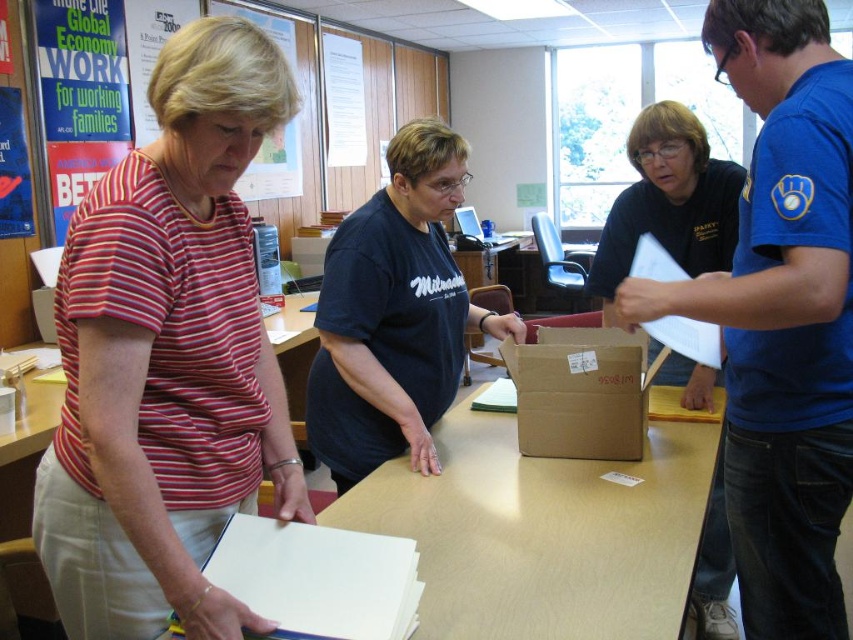
Which of these two, striped cotton shirt at left or brown cardboard box at center, stands taller?

striped cotton shirt at left

Does point (209, 428) lie behind point (517, 358)?

That is False.

Does point (33, 500) lie in front of point (535, 380)?

Yes, point (33, 500) is closer to viewer.

You are a GUI agent. You are given a task and a screenshot of the screen. Output one action in this format:
    pyautogui.click(x=<x>, y=<y>)
    Task: Click on the striped cotton shirt at left
    Image resolution: width=853 pixels, height=640 pixels.
    Given the screenshot: What is the action you would take?
    pyautogui.click(x=167, y=356)

Is point (761, 200) farther from viewer compared to point (612, 216)?

No, (761, 200) is in front of (612, 216).

This screenshot has height=640, width=853. What do you see at coordinates (781, 316) in the screenshot? I see `blue jersey at right` at bounding box center [781, 316].

At what (x,y) coordinates should I click in order to perform the action: click on blue jersey at right. Please return your answer as a coordinate pair (x, y). The image size is (853, 640). Looking at the image, I should click on [x=781, y=316].

What do you see at coordinates (669, 202) in the screenshot? This screenshot has height=640, width=853. I see `matte black shirt at center` at bounding box center [669, 202].

Is matte black shirt at center wider than brown cardboard box at center?

Correct, the width of matte black shirt at center exceeds that of brown cardboard box at center.

Which is behind, point (675, 352) or point (593, 403)?

The point (675, 352) is behind.

This screenshot has height=640, width=853. Find the location of `matte black shirt at center`. matte black shirt at center is located at coordinates (669, 202).